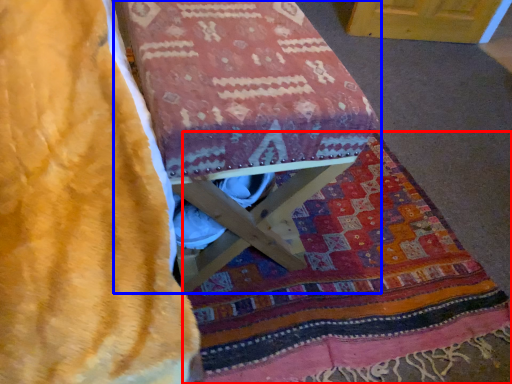
Question: Which of the following is the closest to the observer, blanket (highlighted by a red box) or furniture (highlighted by a blue box)?

Choices:
 (A) blanket
 (B) furniture

Answer: (B)